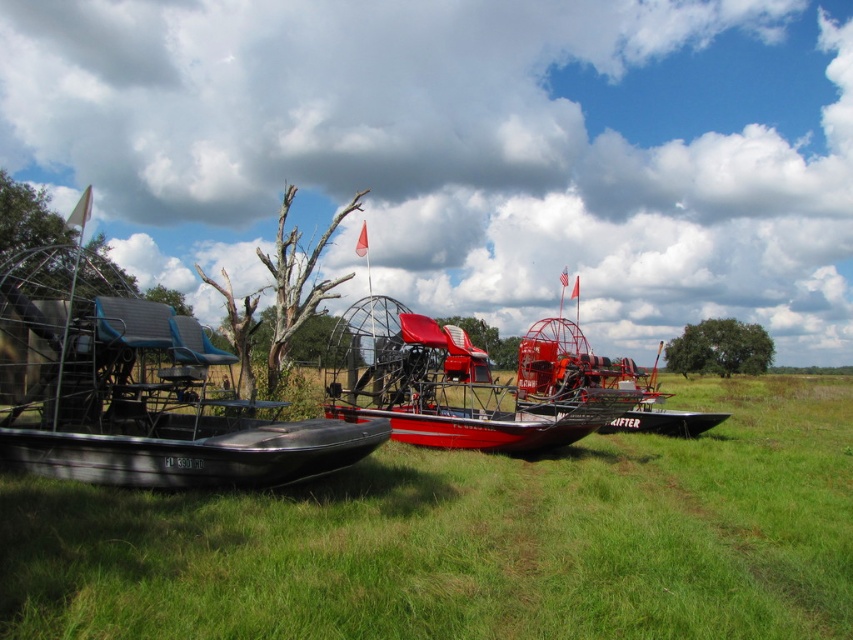
You are standing on the grassy field and want to walk from the black matte airboat at left to the red matte airboat at center. Which direction should you move to reach it?

The black matte airboat at left is located above the red matte airboat at center, so you should move downward to reach it.